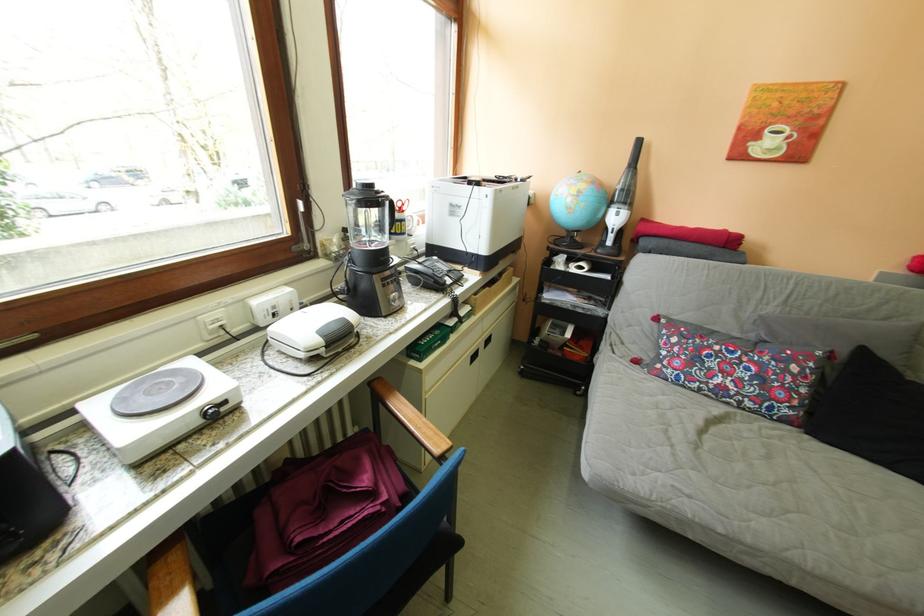
Find the location of a particular element. Image resolution: width=924 pixels, height=616 pixels. waffle maker handle is located at coordinates (407, 419).